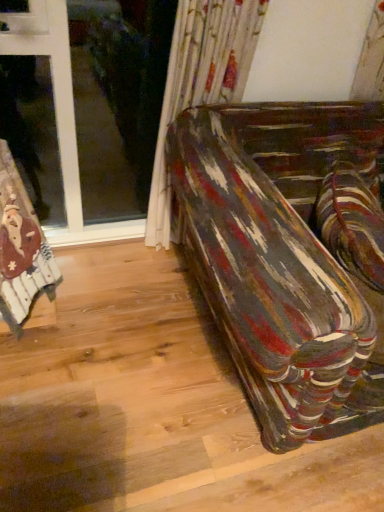
The image size is (384, 512). I want to click on vacant space in front of white fabric tablecloth at left, so click(x=33, y=369).